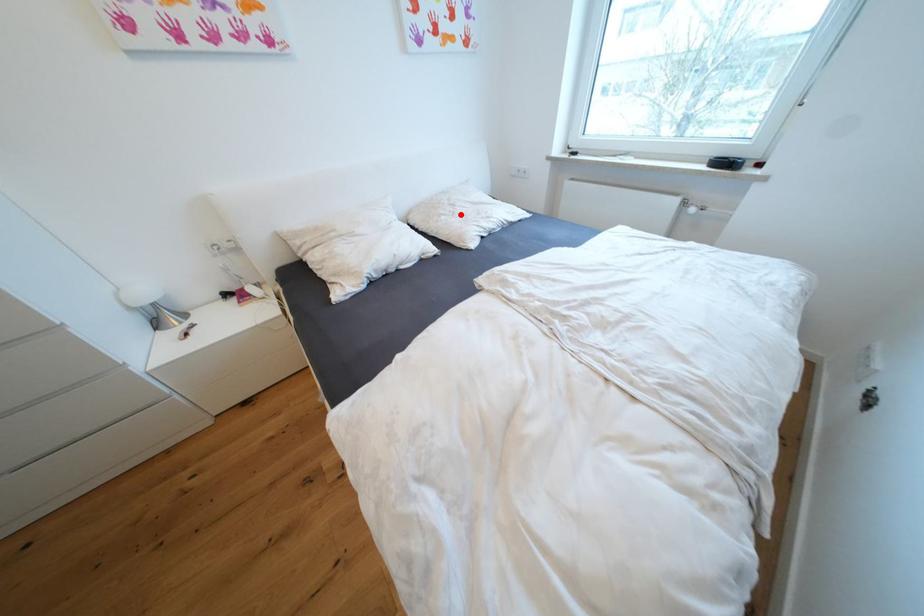
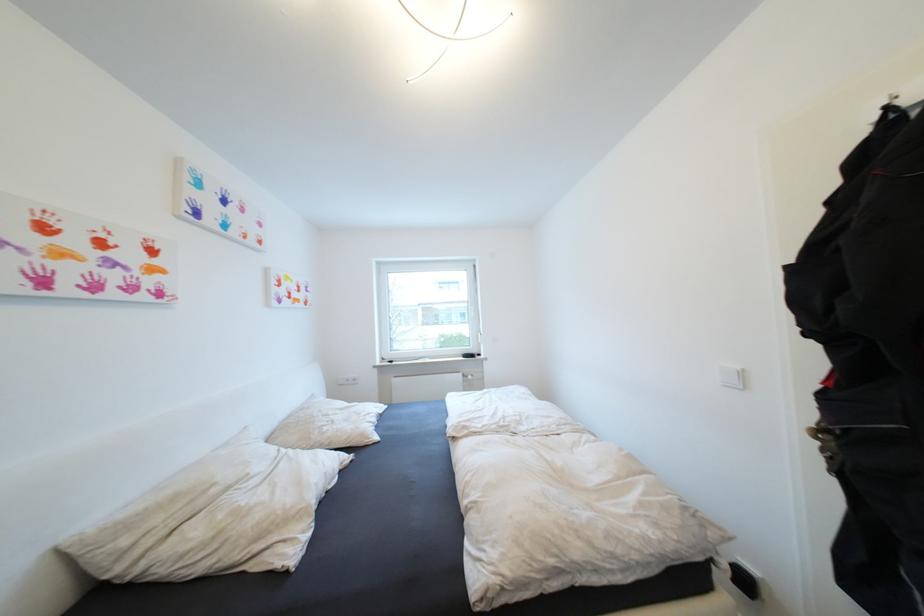
Where in the second image is the point corresponding to the highlighted location from the first image?

(339, 423)